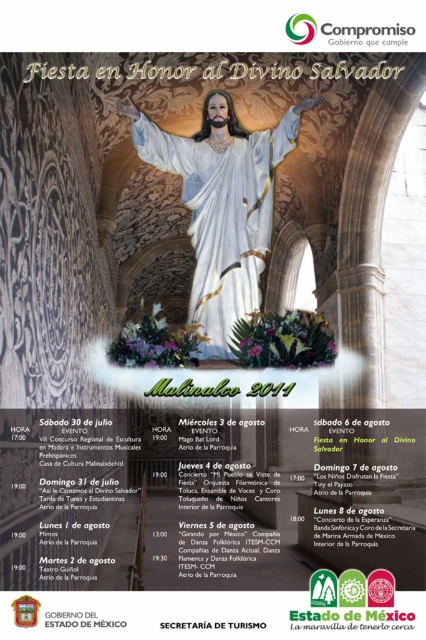
Can you confirm if white marble statue at center is bigger than white paper at center?

Yes.

Is point (247, 269) positioned after point (180, 621)?

Yes, it is.

Find the location of a particular element. white marble statue at center is located at coordinates click(222, 204).